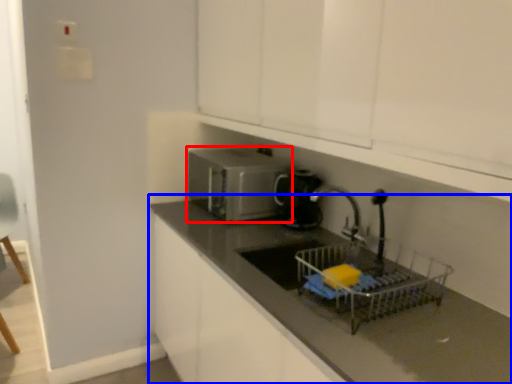
Question: Which of the following is the farthest to the observer, home appliance (highlighted by a red box) or countertop (highlighted by a blue box)?

Choices:
 (A) home appliance
 (B) countertop

Answer: (A)